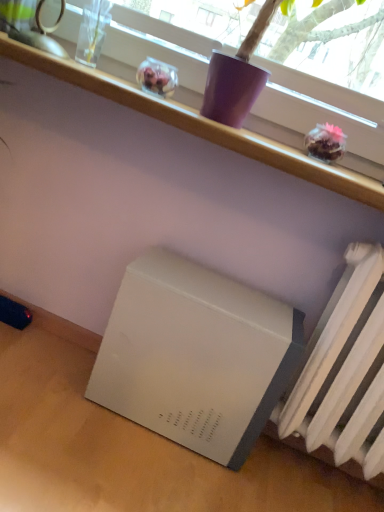
Identify the location of blank space situated above white matte table at lower right (from a real-world perspective). Image resolution: width=384 pixels, height=512 pixels. (132, 437).